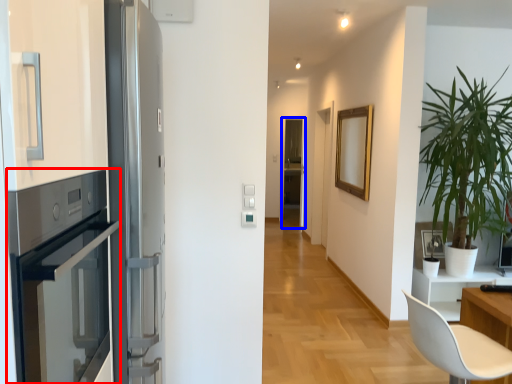
Question: Among these objects, which one is farthest to the camera, oven (highlighted by a red box) or screen door (highlighted by a blue box)?

Choices:
 (A) oven
 (B) screen door

Answer: (B)